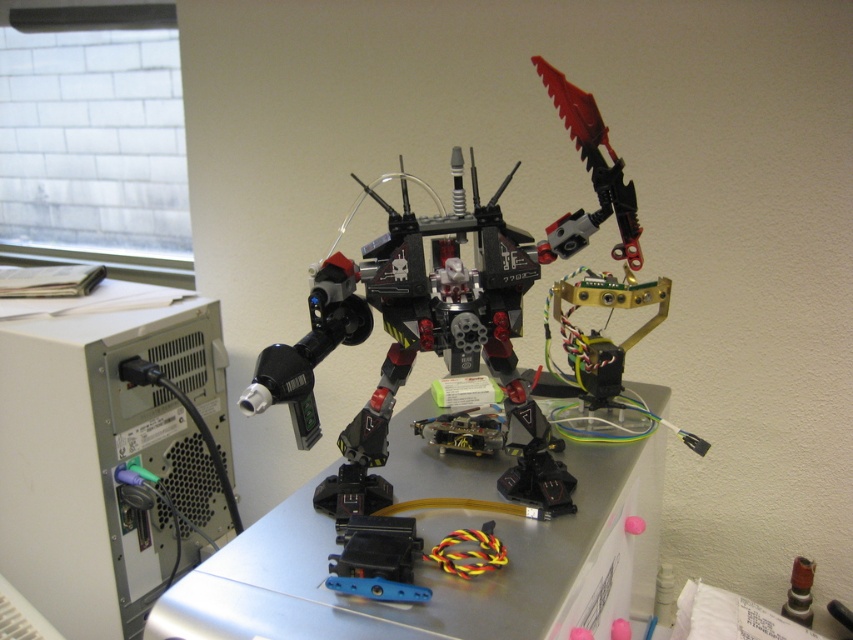
Between black plastic computer at left and metallic gray table at center, which one appears on the left side from the viewer's perspective?

Positioned to the left is black plastic computer at left.

Does black plastic computer at left come behind metallic gray table at center?

Yes, it is behind metallic gray table at center.

Between point (30, 436) and point (229, 586), which one is positioned behind?

Point (30, 436)

Where is `black plastic computer at left`? This screenshot has width=853, height=640. black plastic computer at left is located at coordinates (103, 451).

Is black plastic computer at left bigger than black plastic robot at center?

Incorrect, black plastic computer at left is not larger than black plastic robot at center.

Consider the image. Is the position of black plastic computer at left more distant than that of black plastic robot at center?

Yes, it is behind black plastic robot at center.

Find the location of `black plastic computer at left`. black plastic computer at left is located at coordinates (103, 451).

You are a GUI agent. You are given a task and a screenshot of the screen. Output one action in this format:
    pyautogui.click(x=<x>, y=<y>)
    Task: Click on the black plastic computer at left
    
    Given the screenshot: What is the action you would take?
    pyautogui.click(x=103, y=451)

Who is more distant from viewer, (518, 592) or (397, 365)?

The point (397, 365) is behind.

Does metallic gray table at center have a smaller size compared to black plastic robot at center?

No, metallic gray table at center is not smaller than black plastic robot at center.

The width and height of the screenshot is (853, 640). What are the coordinates of `metallic gray table at center` in the screenshot? It's located at (439, 570).

Identify the location of metallic gray table at center. This screenshot has width=853, height=640. (439, 570).